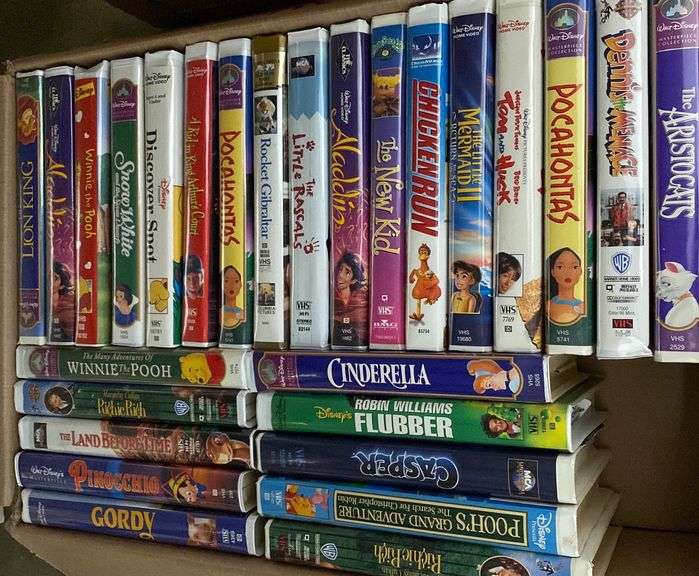
Where is `vhs tapes in left stack`? This screenshot has height=576, width=699. vhs tapes in left stack is located at coordinates (219, 369), (212, 408), (187, 450), (201, 492), (196, 533).